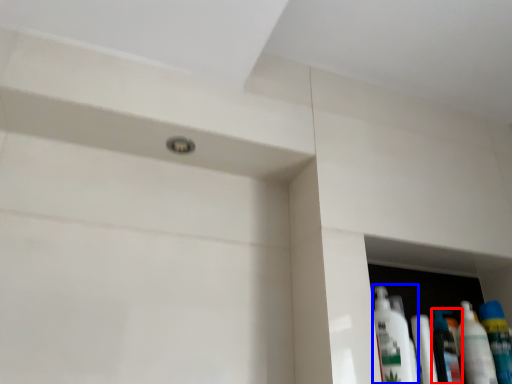
Question: Which point is further to the camera, mouthwash (highlighted by a red box) or cleaning product (highlighted by a blue box)?

Choices:
 (A) mouthwash
 (B) cleaning product

Answer: (A)